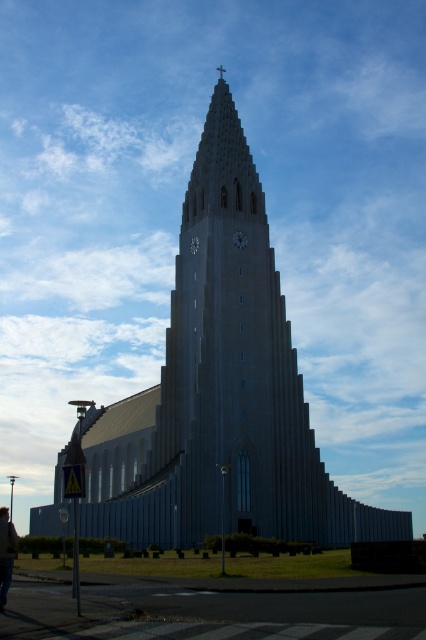
Does smooth gray church at center appear on the left side of matte gray clock at center?

In fact, smooth gray church at center is to the right of matte gray clock at center.

Is smooth gray church at center bigger than matte gray clock at center?

Yes, smooth gray church at center is bigger than matte gray clock at center.

Is point (284, 355) less distant than point (193, 252)?

Yes, it is.

At what (x,y) coordinates should I click in order to perform the action: click on smooth gray church at center. Please return your answer as a coordinate pair (x, y). Image resolution: width=426 pixels, height=640 pixels. Looking at the image, I should click on (221, 392).

Can you confirm if smooth gray church at center is positioned to the left of dark gray jacket at lower left?

In fact, smooth gray church at center is to the right of dark gray jacket at lower left.

Is smooth gray church at center positioned at the back of dark gray jacket at lower left?

That is True.

You are a GUI agent. You are given a task and a screenshot of the screen. Output one action in this format:
    pyautogui.click(x=<x>, y=<y>)
    Task: Click on the smooth gray church at center
    The width and height of the screenshot is (426, 640).
    Given the screenshot: What is the action you would take?
    pyautogui.click(x=221, y=392)

Can you confirm if dark gray jacket at lower left is smaller than matte gray clock at center?

Actually, dark gray jacket at lower left might be larger than matte gray clock at center.

Is dark gray jacket at lower left behind matte gray clock at center?

No.

You are a GUI agent. You are given a task and a screenshot of the screen. Output one action in this format:
    pyautogui.click(x=<x>, y=<y>)
    Task: Click on the dark gray jacket at lower left
    Image resolution: width=426 pixels, height=640 pixels.
    Given the screenshot: What is the action you would take?
    pyautogui.click(x=5, y=554)

The width and height of the screenshot is (426, 640). Identify the location of dark gray jacket at lower left. (5, 554).